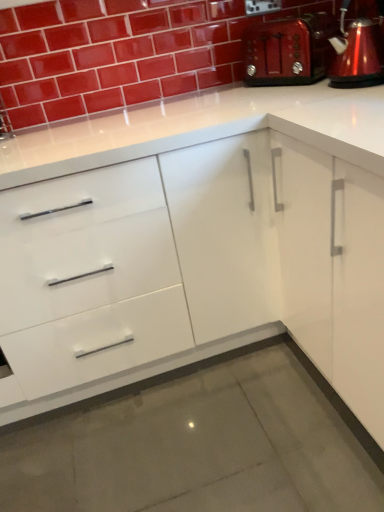
Question: Does metallic red coffeepot at upper right appear on the left side of metallic red toaster at upper right?

Choices:
 (A) no
 (B) yes

Answer: (A)

Question: Is metallic red coffeepot at upper right taller than metallic red toaster at upper right?

Choices:
 (A) no
 (B) yes

Answer: (B)

Question: Is metallic red coffeepot at upper right next to metallic red toaster at upper right?

Choices:
 (A) yes
 (B) no

Answer: (B)

Question: Is metallic red coffeepot at upper right not inside metallic red toaster at upper right?

Choices:
 (A) yes
 (B) no

Answer: (A)

Question: Are metallic red coffeepot at upper right and metallic red toaster at upper right located far from each other?

Choices:
 (A) no
 (B) yes

Answer: (A)

Question: Is metallic red coffeepot at upper right further to camera compared to metallic red toaster at upper right?

Choices:
 (A) no
 (B) yes

Answer: (A)

Question: Is the surface of white glossy cabinet at center in direct contact with metallic red coffeepot at upper right?

Choices:
 (A) yes
 (B) no

Answer: (B)

Question: Is white glossy cabinet at center taller than metallic red coffeepot at upper right?

Choices:
 (A) no
 (B) yes

Answer: (B)

Question: Is white glossy cabinet at center bigger than metallic red coffeepot at upper right?

Choices:
 (A) yes
 (B) no

Answer: (A)

Question: Considering the relative positions of white glossy cabinet at center and metallic red coffeepot at upper right in the image provided, is white glossy cabinet at center to the right of metallic red coffeepot at upper right from the viewer's perspective?

Choices:
 (A) yes
 (B) no

Answer: (B)

Question: Is white glossy cabinet at center surrounding metallic red coffeepot at upper right?

Choices:
 (A) no
 (B) yes

Answer: (A)

Question: Can we say white glossy cabinet at center lies outside metallic red coffeepot at upper right?

Choices:
 (A) yes
 (B) no

Answer: (A)

Question: From the image's perspective, is metallic red toaster at upper right above metallic red coffeepot at upper right?

Choices:
 (A) yes
 (B) no

Answer: (A)